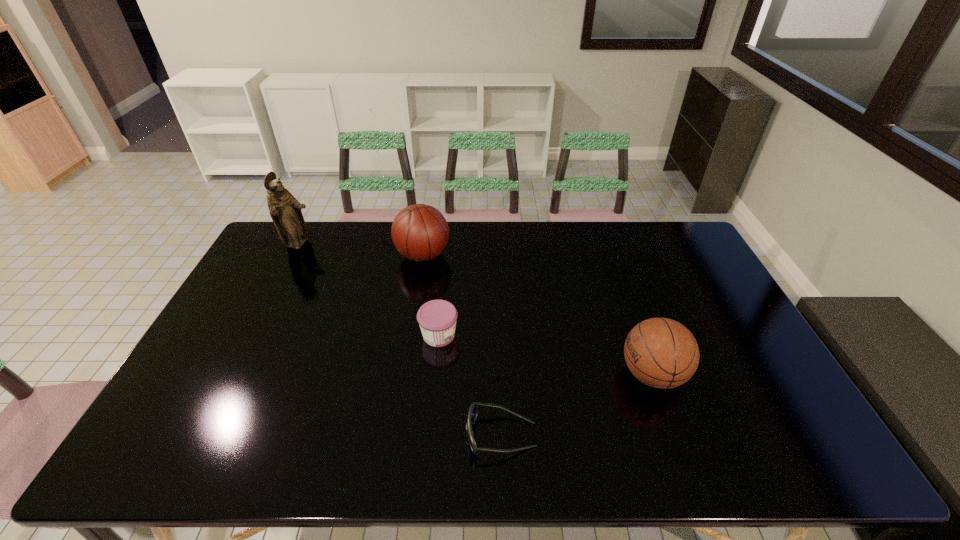
Image resolution: width=960 pixels, height=540 pixels. I want to click on object located at the left edge, so click(x=285, y=210).

Where is `object that is positioned at the far left corner`? The width and height of the screenshot is (960, 540). object that is positioned at the far left corner is located at coordinates (285, 210).

In the image, there is a desktop. Where is `vacant area at the far edge`? The height and width of the screenshot is (540, 960). vacant area at the far edge is located at coordinates (354, 226).

Find the location of a particular element. This screenshot has width=960, height=540. free location at the near edge is located at coordinates (465, 448).

This screenshot has height=540, width=960. I want to click on vacant region at the left edge of the desktop, so click(276, 265).

In the image, there is a desktop. At what (x,y) coordinates should I click in order to perform the action: click on vacant area at the right edge. Please return your answer as a coordinate pair (x, y). The width and height of the screenshot is (960, 540). Looking at the image, I should click on (746, 390).

This screenshot has width=960, height=540. I want to click on free space at the far right corner, so click(x=690, y=249).

What are the coordinates of `vacant space that is in between the leftmost object and the jam` in the screenshot? It's located at (x=369, y=290).

Image resolution: width=960 pixels, height=540 pixels. Find the location of `empty space between the jam and the figurine`. empty space between the jam and the figurine is located at coordinates (369, 290).

Image resolution: width=960 pixels, height=540 pixels. What are the coordinates of `vacant area that lies between the figurine and the fourth tallest object` in the screenshot? It's located at (369, 290).